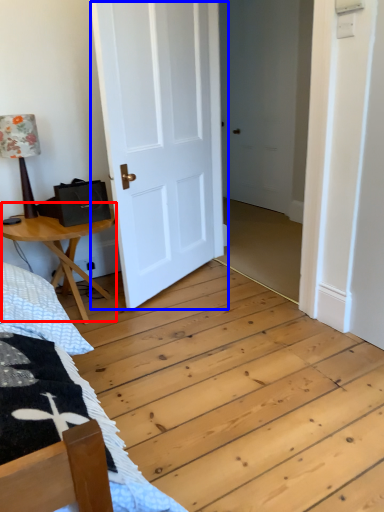
Question: Among these objects, which one is nearest to the camera, table (highlighted by a red box) or door (highlighted by a blue box)?

Choices:
 (A) table
 (B) door

Answer: (B)